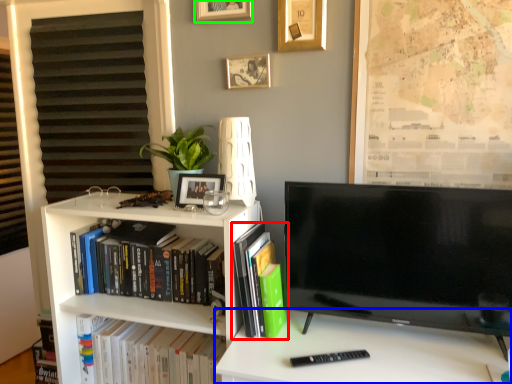
Question: Considering the real-world distances, which object is farthest from book (highlighted by a red box)? desk (highlighted by a blue box) or picture frame (highlighted by a green box)?

Choices:
 (A) desk
 (B) picture frame

Answer: (B)